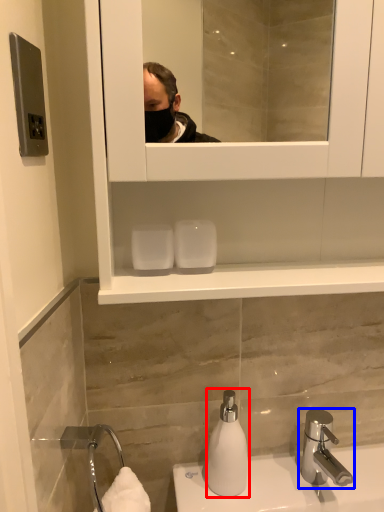
Question: Among these objects, which one is nearest to the camera, soap dispenser (highlighted by a red box) or tap (highlighted by a blue box)?

Choices:
 (A) soap dispenser
 (B) tap

Answer: (B)